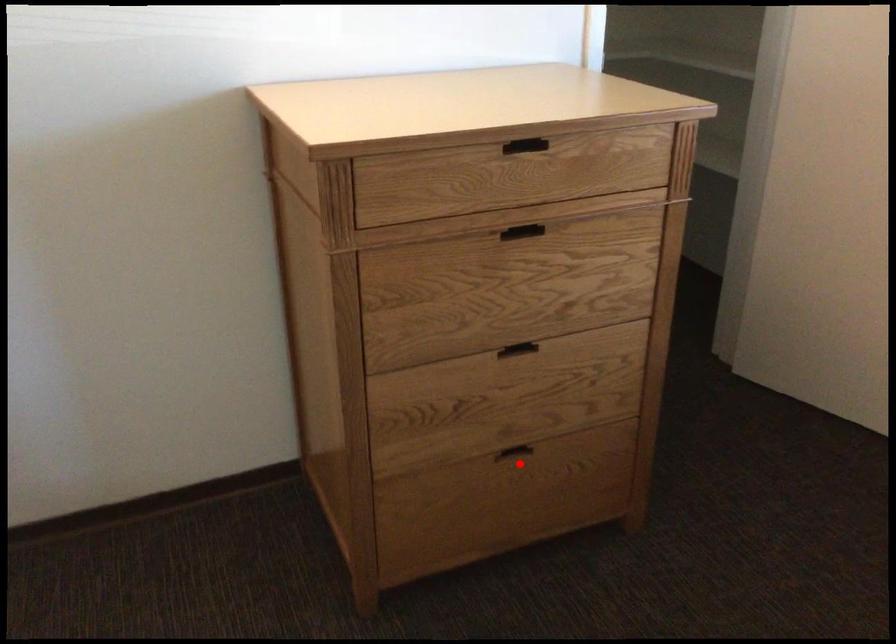
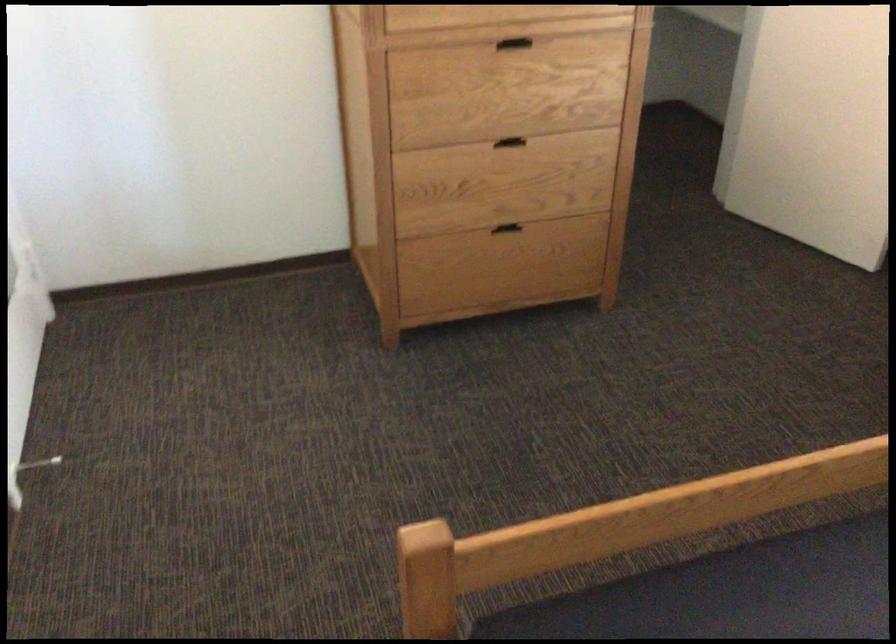
Question: I am providing you with two images of the same scene from different viewpoints. Given a red point in image1, look at the same physical point in image2. Is it:

Choices:
 (A) Closer to the viewpoint
 (B) Farther from the viewpoint

Answer: (B)